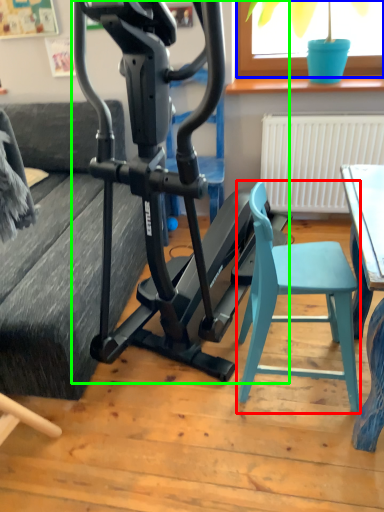
Question: Which object is the closest to the folding chair (highlighted by a red box)? Choose among these: window screen (highlighted by a blue box) or stationary bicycle (highlighted by a green box).

Choices:
 (A) window screen
 (B) stationary bicycle

Answer: (B)